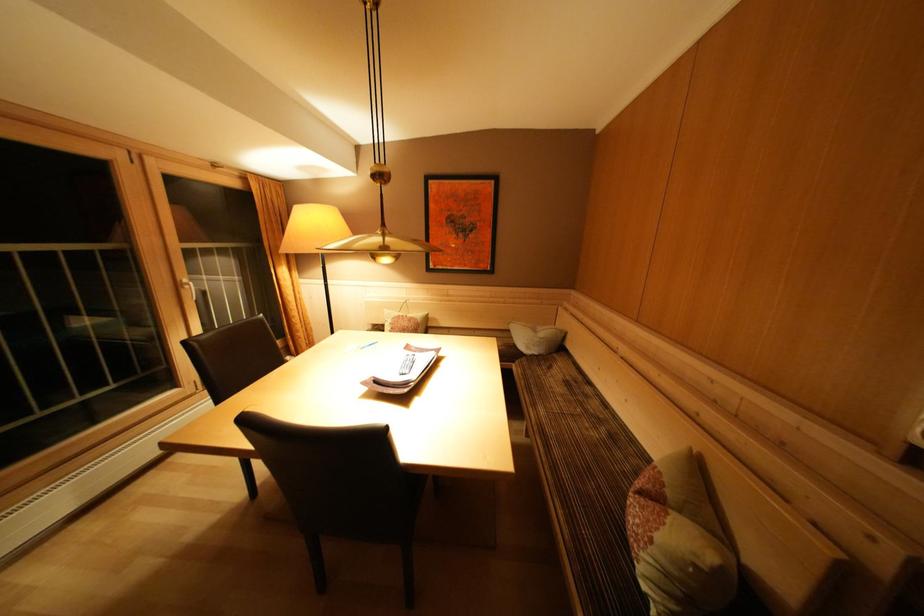
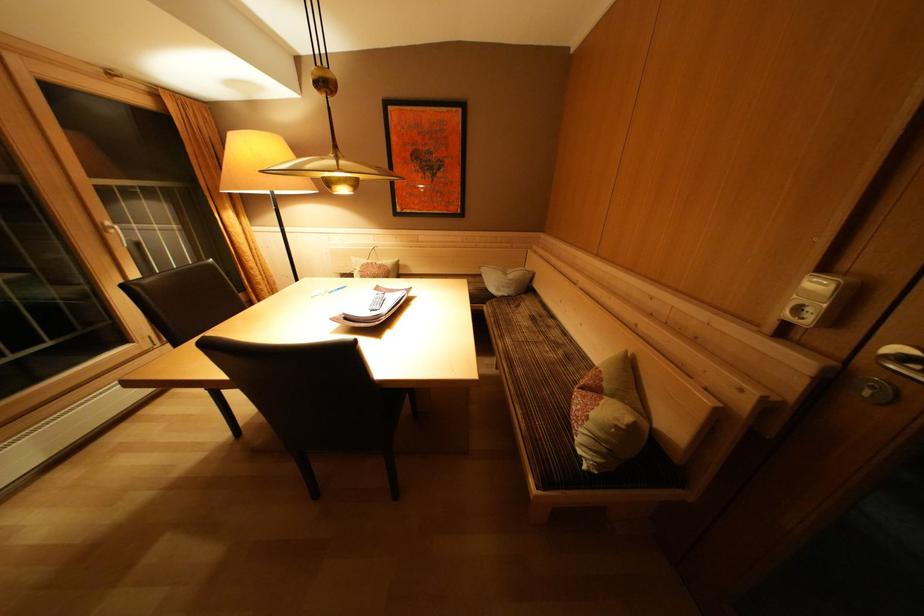
The point at (549, 339) is marked in the first image. Where is the corresponding point in the second image?

(517, 281)